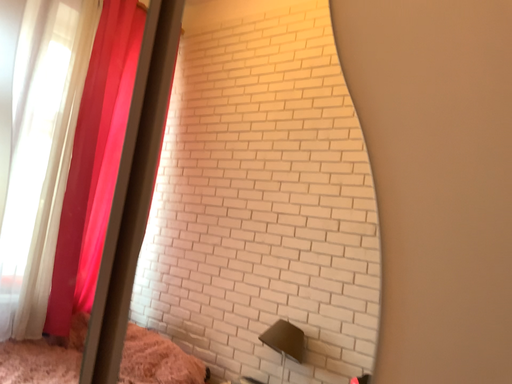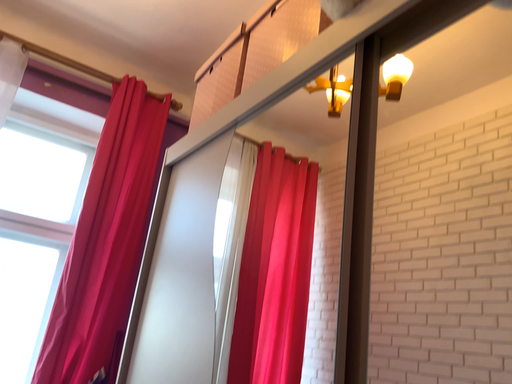
Question: How did the camera likely rotate when shooting the video?

Choices:
 (A) rotated downward
 (B) rotated upward

Answer: (B)